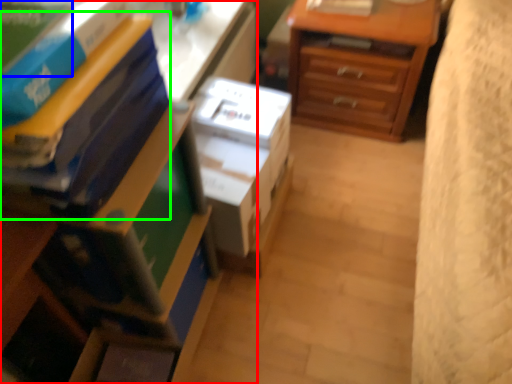
Question: Estimate the real-world distances between objects in this image. Which object is farther from nightstand (highlighted by a red box), paperback book (highlighted by a blue box) or paperback book (highlighted by a green box)?

Choices:
 (A) paperback book
 (B) paperback book

Answer: (A)